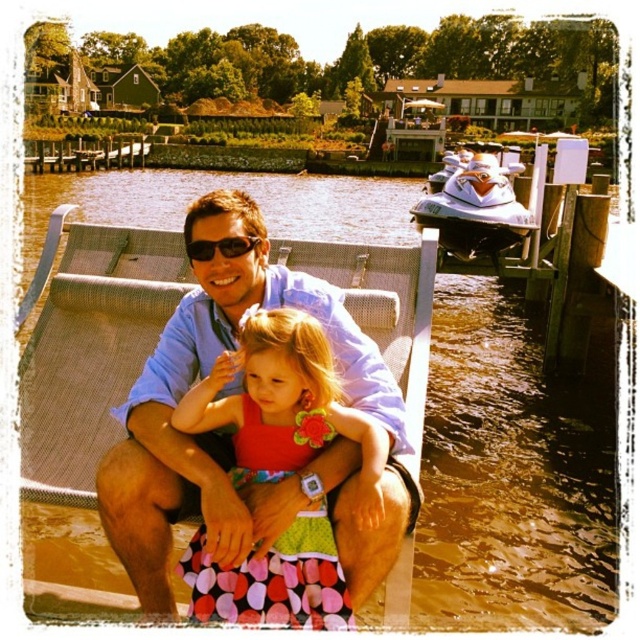
Is point (186, 296) farther from camera compared to point (193, 579)?

Yes, point (186, 296) is behind point (193, 579).

This screenshot has height=640, width=640. What do you see at coordinates (228, 435) in the screenshot?
I see `matte blue shirt at center` at bounding box center [228, 435].

This screenshot has width=640, height=640. I want to click on matte blue shirt at center, so click(x=228, y=435).

Does polka dot fabric dress at center have a lesser width compared to white glossy jet ski at right?

Indeed, polka dot fabric dress at center has a lesser width compared to white glossy jet ski at right.

Does polka dot fabric dress at center have a greater width compared to white glossy jet ski at right?

No, polka dot fabric dress at center is not wider than white glossy jet ski at right.

This screenshot has width=640, height=640. Describe the element at coordinates (284, 404) in the screenshot. I see `polka dot fabric dress at center` at that location.

Locate an element on the screen. polka dot fabric dress at center is located at coordinates (284, 404).

Who is more forward, (307, 516) or (227, 248)?

Point (307, 516)

Who is lower down, polka dot fabric dress at center or matte black sunglasses at center?

polka dot fabric dress at center is lower down.

The height and width of the screenshot is (640, 640). I want to click on polka dot fabric dress at center, so click(x=284, y=404).